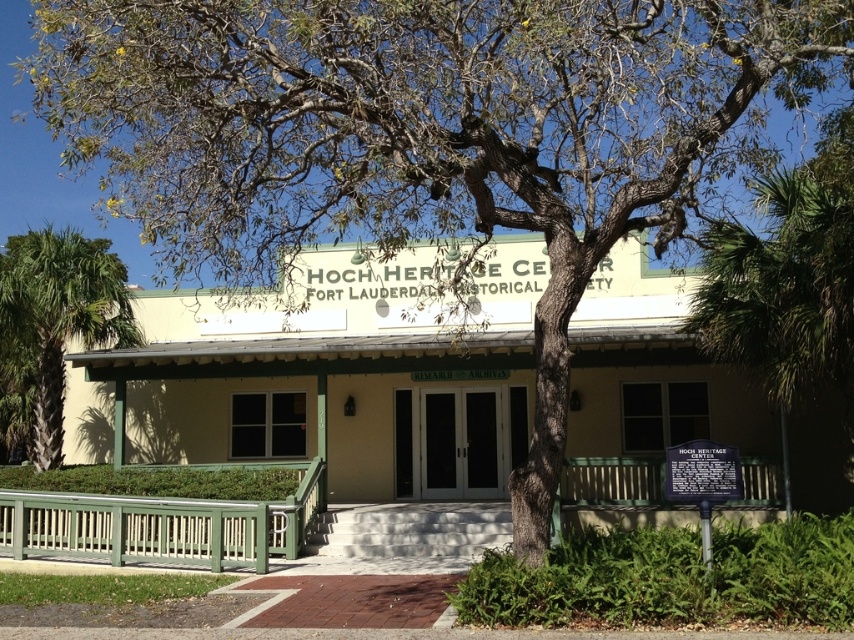
Who is positioned more to the right, green wooden porch at center or green leafy tree at right?

green leafy tree at right is more to the right.

Between point (306, 516) and point (717, 332), which one is positioned in front?

Positioned in front is point (717, 332).

You are a GUI agent. You are given a task and a screenshot of the screen. Output one action in this format:
    pyautogui.click(x=<x>, y=<y>)
    Task: Click on the green wooden porch at center
    This screenshot has width=854, height=640.
    Given the screenshot: What is the action you would take?
    pyautogui.click(x=214, y=518)

Does green leafy palm tree at lower left appear on the left side of metallic plaque at center?

Yes, green leafy palm tree at lower left is to the left of metallic plaque at center.

Which of these two, green leafy palm tree at lower left or metallic plaque at center, stands shorter?

With less height is metallic plaque at center.

Between point (71, 257) and point (687, 442), which one is positioned in front?

Point (687, 442) is more forward.

Identify the location of green leafy palm tree at lower left. This screenshot has height=640, width=854. (53, 328).

Which is behind, point (851, 132) or point (676, 490)?

Positioned behind is point (851, 132).

Describe the element at coordinates (788, 280) in the screenshot. I see `green leafy tree at right` at that location.

Is point (840, 282) positioned behind point (692, 460)?

Yes, it is.

At what (x,y) coordinates should I click in order to perform the action: click on green leafy tree at right. Please return your answer as a coordinate pair (x, y). Looking at the image, I should click on tap(788, 280).